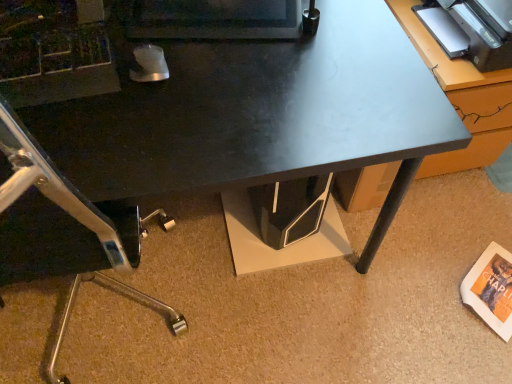
Locate an element on the screen. The image size is (512, 384). vacant space situated above black glossy desk at center (from a real-world perspective) is located at coordinates (156, 55).